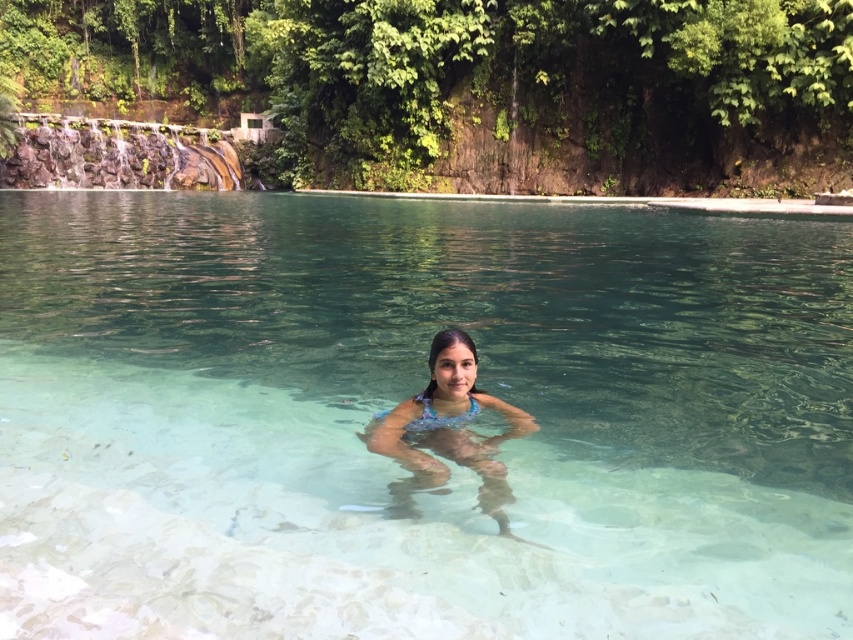
You are a photographer standing in front of the clear glass pool at center. You want to take a photo of the pool without any obstructions. Since you need to stay at least 3 meters away from the edge of the pool for safety, will you be able to take the photo from your current position?

The clear glass pool at center is 3.13 meters from camera. Since you need to stay at least 3 meters away, you can take the photo from your current position as you are just slightly beyond the required distance.

You are a photographer positioned at the edge of the clear glass pool at center. You want to take a photo of the translucent blue bikini at center without the pool water appearing in the foreground. Is this possible given their positions?

The clear glass pool at center is in front of the translucent blue bikini at center, so the pool water will block the view of the bikini. To avoid the pool water in the foreground, you need to adjust your position or angle to ensure the bikini is not obscured by the pool.

You are a photographer trying to capture the serene natural pool surrounded by lush greenery. You notice a point at coordinates (413, 394) in your camera viewfinder. Based on the scene description, what object does this point likely represent?

The point at coordinates (413, 394) corresponds to the clear glass pool at center.